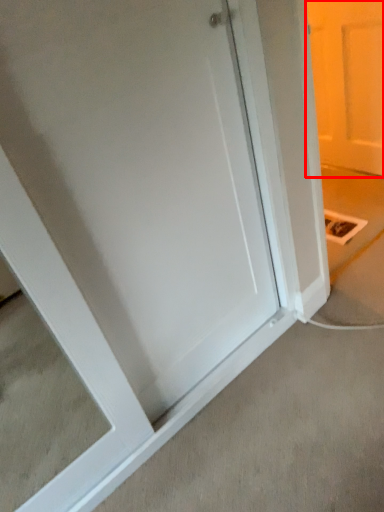
Question: In this image, where is door (annotated by the red box) located relative to concrete?

Choices:
 (A) right
 (B) left

Answer: (A)